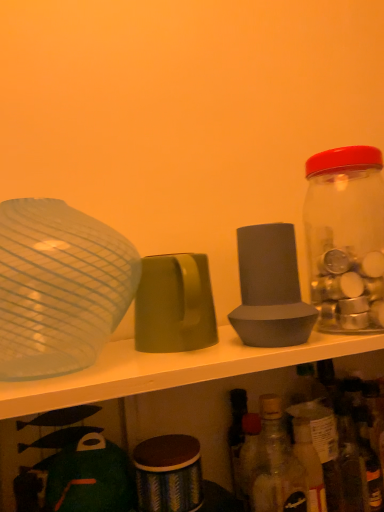
This screenshot has width=384, height=512. I want to click on translucent glass bottle at lower right, acting as the 1th bottle starting from the bottom, so click(x=276, y=465).

What do you see at coordinates (270, 289) in the screenshot?
I see `gray matte speaker at center, which ranks as the 3th tableware in left-to-right order` at bounding box center [270, 289].

Find the location of a particular element. This screenshot has width=384, height=512. matte green cup at center, the 2th tableware viewed from the left is located at coordinates (174, 304).

This screenshot has height=512, width=384. What do you see at coordinates (174, 304) in the screenshot?
I see `matte green cup at center, the 2th tableware viewed from the left` at bounding box center [174, 304].

Locate an element on the screen. translucent glass bottle at lower right, the second bottle from the right is located at coordinates pos(276,465).

At what (x,y) coordinates should I click in order to perform the action: click on tableware that is the 2nd one when counting downward from the transparent glass jar at right, the 1th bottle from the right (from the image's perspective). Please return your answer as a coordinate pair (x, y). Image resolution: width=384 pixels, height=512 pixels. Looking at the image, I should click on (59, 287).

From the picture: Considering the relative positions of transparent glass bowl at left, which is the 3th tableware from right to left, and transparent glass jar at right, the 1th bottle from the right, in the image provided, is transparent glass bowl at left, which is the 3th tableware from right to left, to the right of transparent glass jar at right, the 1th bottle from the right, from the viewer's perspective?

No, transparent glass bowl at left, which is the 3th tableware from right to left, is not to the right of transparent glass jar at right, the 1th bottle from the right.

Are transparent glass bowl at left, which is the 1th tableware from left to right, and transparent glass jar at right, placed as the 1th bottle when sorted from top to bottom, far apart?

No.

Considering the relative sizes of transparent glass bowl at left, which is the 1th tableware from left to right, and translucent glass bottle at lower right, the second bottle from the right, in the image provided, is transparent glass bowl at left, which is the 1th tableware from left to right, shorter than translucent glass bottle at lower right, the second bottle from the right,?

Correct, transparent glass bowl at left, which is the 1th tableware from left to right, is not as tall as translucent glass bottle at lower right, the second bottle from the right.

Could you tell me if transparent glass bowl at left, which is the 3th tableware from right to left, is facing translucent glass bottle at lower right, the second bottle from the right?

No.

What's the angular difference between transparent glass bowl at left, which is the 1th tableware from left to right, and translucent glass bottle at lower right, which is the first bottle from left to right,'s facing directions?

1.01 degrees.

Does point (24, 314) come closer to viewer compared to point (268, 402)?

Yes, it is in front of point (268, 402).

Would you say transparent glass jar at right, which ranks as the 2th bottle in bottom-to-top order, is part of gray matte speaker at center, which ranks as the 3th tableware in left-to-right order,'s contents?

No, transparent glass jar at right, which ranks as the 2th bottle in bottom-to-top order, is not surrounded by gray matte speaker at center, which ranks as the 3th tableware in left-to-right order.

Does gray matte speaker at center, which ranks as the 3th tableware in left-to-right order, have a larger size compared to transparent glass jar at right, the 1th bottle from the right?

Incorrect, gray matte speaker at center, which ranks as the 3th tableware in left-to-right order, is not larger than transparent glass jar at right, the 1th bottle from the right.

Considering the sizes of objects gray matte speaker at center, the 1th tableware in the right-to-left sequence, and transparent glass jar at right, which ranks as the 2th bottle in left-to-right order, in the image provided, who is wider, gray matte speaker at center, the 1th tableware in the right-to-left sequence, or transparent glass jar at right, which ranks as the 2th bottle in left-to-right order,?

With larger width is transparent glass jar at right, which ranks as the 2th bottle in left-to-right order.

Based on the photo, is gray matte speaker at center, which ranks as the 3th tableware in left-to-right order, turned away from transparent glass jar at right, which ranks as the 2th bottle in bottom-to-top order?

No, gray matte speaker at center, which ranks as the 3th tableware in left-to-right order, is not facing away from transparent glass jar at right, which ranks as the 2th bottle in bottom-to-top order.

Is translucent glass bottle at lower right, which is the first bottle from left to right, not within matte green cup at center, the 2th tableware positioned from the right?

Yes, translucent glass bottle at lower right, which is the first bottle from left to right, is not within matte green cup at center, the 2th tableware positioned from the right.

Is translucent glass bottle at lower right, which ranks as the 2th bottle in top-to-bottom order, oriented towards matte green cup at center, the 2th tableware positioned from the right?

No, translucent glass bottle at lower right, which ranks as the 2th bottle in top-to-bottom order, is not oriented towards matte green cup at center, the 2th tableware positioned from the right.

From the image's perspective, is translucent glass bottle at lower right, which ranks as the 2th bottle in top-to-bottom order, under matte green cup at center, the 2th tableware positioned from the right?

Yes.

Which of these two, translucent glass bottle at lower right, the second bottle from the right, or matte green cup at center, the 2th tableware viewed from the left, stands shorter?

Standing shorter between the two is matte green cup at center, the 2th tableware viewed from the left.

From the image's perspective, is matte green cup at center, the 2th tableware viewed from the left, beneath transparent glass bowl at left, which is the 3th tableware from right to left?

Yes.

Locate an element on the screen. The height and width of the screenshot is (512, 384). the 2nd tableware below the transparent glass bowl at left, which is the 1th tableware from left to right (from a real-world perspective) is located at coordinates (174, 304).

Considering the relative sizes of matte green cup at center, the 2th tableware viewed from the left, and transparent glass bowl at left, which is the 3th tableware from right to left, in the image provided, is matte green cup at center, the 2th tableware viewed from the left, bigger than transparent glass bowl at left, which is the 3th tableware from right to left,?

No, matte green cup at center, the 2th tableware viewed from the left, is not bigger than transparent glass bowl at left, which is the 3th tableware from right to left.

Is matte green cup at center, the 2th tableware positioned from the right, positioned behind transparent glass jar at right, which ranks as the 2th bottle in left-to-right order?

No, matte green cup at center, the 2th tableware positioned from the right, is closer to the camera.

Between point (210, 304) and point (327, 296), which one is positioned in front?

The point (327, 296) is closer to the camera.

Is matte green cup at center, the 2th tableware viewed from the left, looking in the opposite direction of transparent glass jar at right, placed as the 1th bottle when sorted from top to bottom?

That's not correct — matte green cup at center, the 2th tableware viewed from the left, is not looking away from transparent glass jar at right, placed as the 1th bottle when sorted from top to bottom.

Is matte green cup at center, the 2th tableware viewed from the left, placed right next to transparent glass jar at right, the 1th bottle from the right?

No, matte green cup at center, the 2th tableware viewed from the left, is not next to transparent glass jar at right, the 1th bottle from the right.

Which is behind, point (375, 254) or point (32, 326)?

Point (375, 254)

Is transparent glass jar at right, placed as the 1th bottle when sorted from top to bottom, shorter than transparent glass bowl at left, which is the 3th tableware from right to left?

No, transparent glass jar at right, placed as the 1th bottle when sorted from top to bottom, is not shorter than transparent glass bowl at left, which is the 3th tableware from right to left.

Where is `the 3rd tableware in front of the transparent glass jar at right, the 1th bottle from the right, counting from the anchor's position`? the 3rd tableware in front of the transparent glass jar at right, the 1th bottle from the right, counting from the anchor's position is located at coordinates (59, 287).

Does transparent glass jar at right, which ranks as the 2th bottle in bottom-to-top order, have a greater width compared to transparent glass bowl at left, which is the 3th tableware from right to left?

Incorrect, the width of transparent glass jar at right, which ranks as the 2th bottle in bottom-to-top order, does not surpass that of transparent glass bowl at left, which is the 3th tableware from right to left.

Where is `bottle that is the 2nd object located behind the transparent glass bowl at left, which is the 3th tableware from right to left`? The width and height of the screenshot is (384, 512). bottle that is the 2nd object located behind the transparent glass bowl at left, which is the 3th tableware from right to left is located at coordinates (346, 238).

Locate an element on the screen. This screenshot has width=384, height=512. tableware that is the 2nd one when counting upward from the translucent glass bottle at lower right, the second bottle from the right (from the image's perspective) is located at coordinates (59, 287).

Considering their positions, is gray matte speaker at center, the 1th tableware in the right-to-left sequence, positioned closer to matte green cup at center, the 2th tableware viewed from the left, than translucent glass bottle at lower right, which is the first bottle from left to right?

gray matte speaker at center, the 1th tableware in the right-to-left sequence, is positioned closer to the anchor matte green cup at center, the 2th tableware viewed from the left.

Considering their positions, is transparent glass bowl at left, which is the 3th tableware from right to left, positioned closer to gray matte speaker at center, the 1th tableware in the right-to-left sequence, than translucent glass bottle at lower right, acting as the 1th bottle starting from the bottom?

translucent glass bottle at lower right, acting as the 1th bottle starting from the bottom.

From the image, which object appears to be farther from gray matte speaker at center, which ranks as the 3th tableware in left-to-right order, transparent glass jar at right, which ranks as the 2th bottle in left-to-right order, or transparent glass bowl at left, which is the 3th tableware from right to left?

The object further to gray matte speaker at center, which ranks as the 3th tableware in left-to-right order, is transparent glass bowl at left, which is the 3th tableware from right to left.

Estimate the real-world distances between objects in this image. Which object is closer to gray matte speaker at center, which ranks as the 3th tableware in left-to-right order, matte green cup at center, the 2th tableware positioned from the right, or transparent glass bowl at left, which is the 3th tableware from right to left?

Among the two, matte green cup at center, the 2th tableware positioned from the right, is located nearer to gray matte speaker at center, which ranks as the 3th tableware in left-to-right order.

Estimate the real-world distances between objects in this image. Which object is closer to translucent glass bottle at lower right, which ranks as the 2th bottle in top-to-bottom order, gray matte speaker at center, which ranks as the 3th tableware in left-to-right order, or matte green cup at center, the 2th tableware viewed from the left?

gray matte speaker at center, which ranks as the 3th tableware in left-to-right order, lies closer to translucent glass bottle at lower right, which ranks as the 2th bottle in top-to-bottom order, than the other object.

Based on their spatial positions, is transparent glass bowl at left, which is the 1th tableware from left to right, or translucent glass bottle at lower right, the second bottle from the right, further from matte green cup at center, the 2th tableware viewed from the left?

translucent glass bottle at lower right, the second bottle from the right, is further to matte green cup at center, the 2th tableware viewed from the left.

Looking at the image, which one is located further to transparent glass jar at right, placed as the 1th bottle when sorted from top to bottom, translucent glass bottle at lower right, the second bottle from the right, or matte green cup at center, the 2th tableware viewed from the left?

Based on the image, translucent glass bottle at lower right, the second bottle from the right, appears to be further to transparent glass jar at right, placed as the 1th bottle when sorted from top to bottom.

Based on their spatial positions, is matte green cup at center, the 2th tableware viewed from the left, or transparent glass bowl at left, which is the 3th tableware from right to left, further from translucent glass bottle at lower right, the second bottle from the right?

transparent glass bowl at left, which is the 3th tableware from right to left.

This screenshot has height=512, width=384. In order to click on tableware between transparent glass bowl at left, which is the 3th tableware from right to left, and translucent glass bottle at lower right, which is the first bottle from left to right, from top to bottom in this screenshot , I will do (174, 304).

The height and width of the screenshot is (512, 384). Identify the location of tableware between transparent glass bowl at left, which is the 3th tableware from right to left, and gray matte speaker at center, the 1th tableware in the right-to-left sequence, from left to right. (174, 304).

The width and height of the screenshot is (384, 512). Find the location of `tableware between matte green cup at center, the 2th tableware viewed from the left, and transparent glass jar at right, which ranks as the 2th bottle in bottom-to-top order, in the horizontal direction`. tableware between matte green cup at center, the 2th tableware viewed from the left, and transparent glass jar at right, which ranks as the 2th bottle in bottom-to-top order, in the horizontal direction is located at coordinates (270, 289).

This screenshot has width=384, height=512. What are the coordinates of `bottle situated between transparent glass bowl at left, which is the 1th tableware from left to right, and transparent glass jar at right, which ranks as the 2th bottle in left-to-right order, from left to right` in the screenshot? It's located at (276, 465).